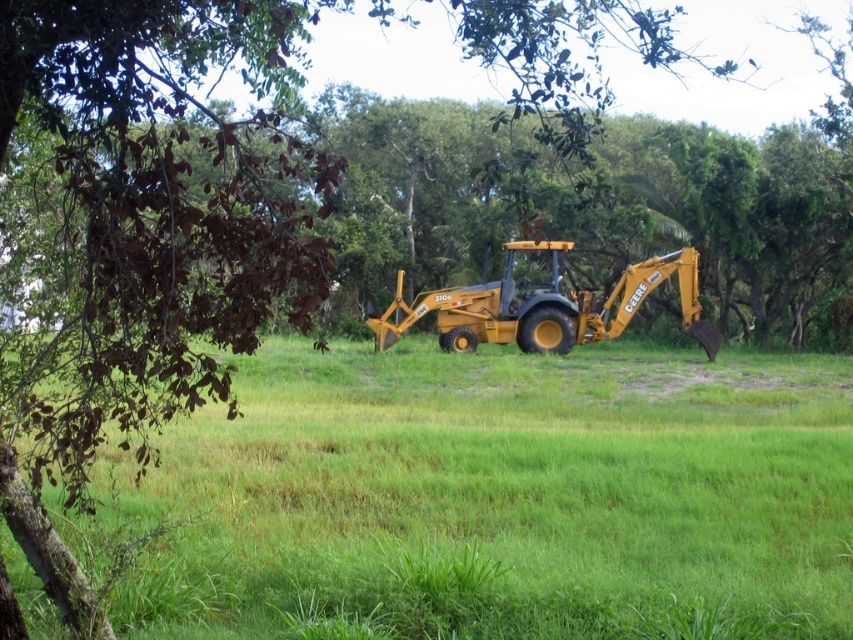
Question: Which object is farther from the camera taking this photo?

Choices:
 (A) yellow rubber tractor at center
 (B) yellow metallic tractor at center

Answer: (B)

Question: Does yellow rubber tractor at center appear on the left side of yellow metallic tractor at center?

Choices:
 (A) no
 (B) yes

Answer: (B)

Question: In this image, where is yellow rubber tractor at center located relative to yellow metallic tractor at center?

Choices:
 (A) left
 (B) right

Answer: (A)

Question: Which point is farther from the camera taking this photo?

Choices:
 (A) (726, 420)
 (B) (668, 259)

Answer: (B)

Question: Which of the following is the closest to the observer?

Choices:
 (A) yellow metallic tractor at center
 (B) yellow rubber tractor at center

Answer: (B)

Question: Is yellow rubber tractor at center smaller than yellow metallic tractor at center?

Choices:
 (A) no
 (B) yes

Answer: (A)